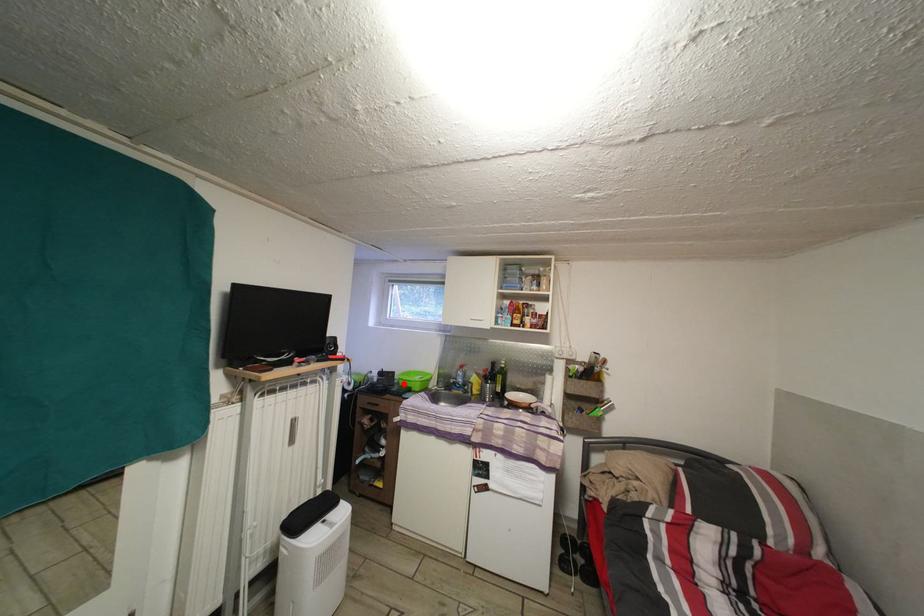
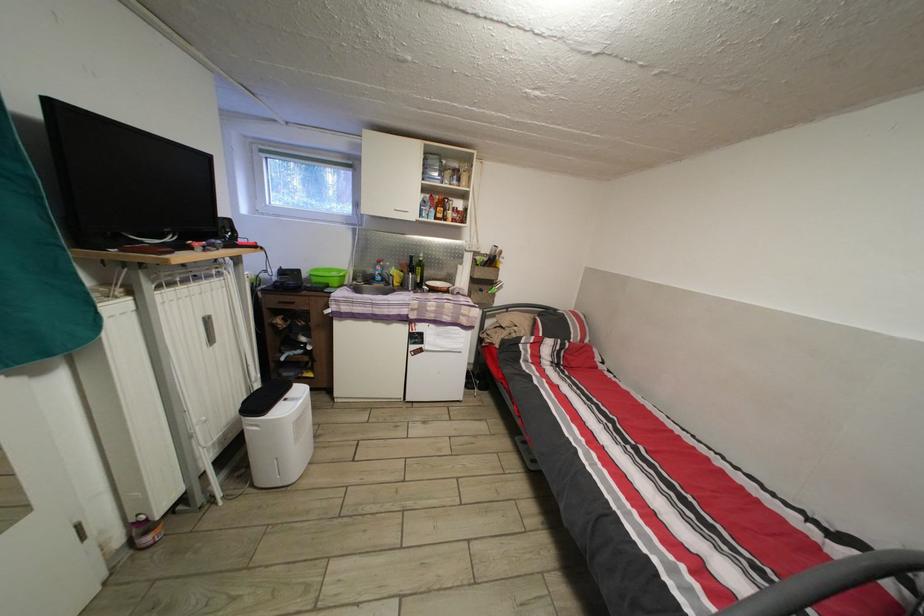
Question: A red point is marked in image1. In image2, is the corresponding 3D point closer to the camera or farther? Reply with the corresponding letter.

Choices:
 (A) The corresponding 3D point is closer.
 (B) The corresponding 3D point is farther.

Answer: (A)